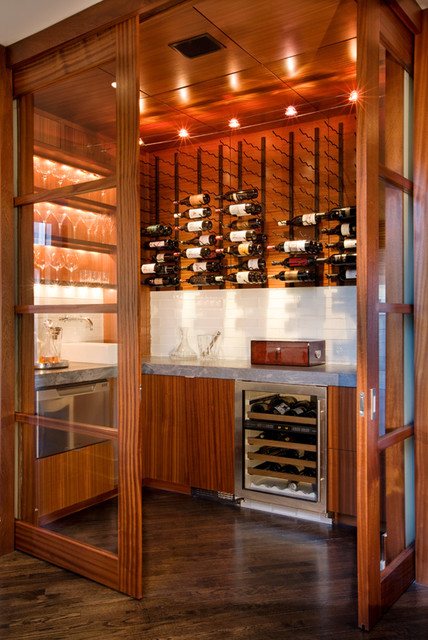
Find the location of `lock on door`. lock on door is located at coordinates (373, 400).